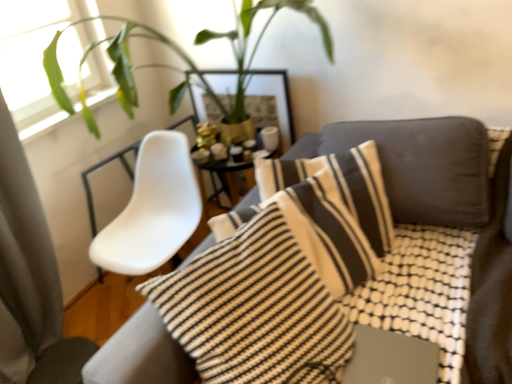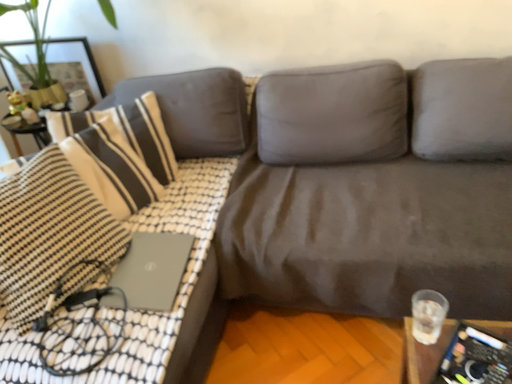
Question: How did the camera likely rotate when shooting the video?

Choices:
 (A) rotated left
 (B) rotated right

Answer: (B)